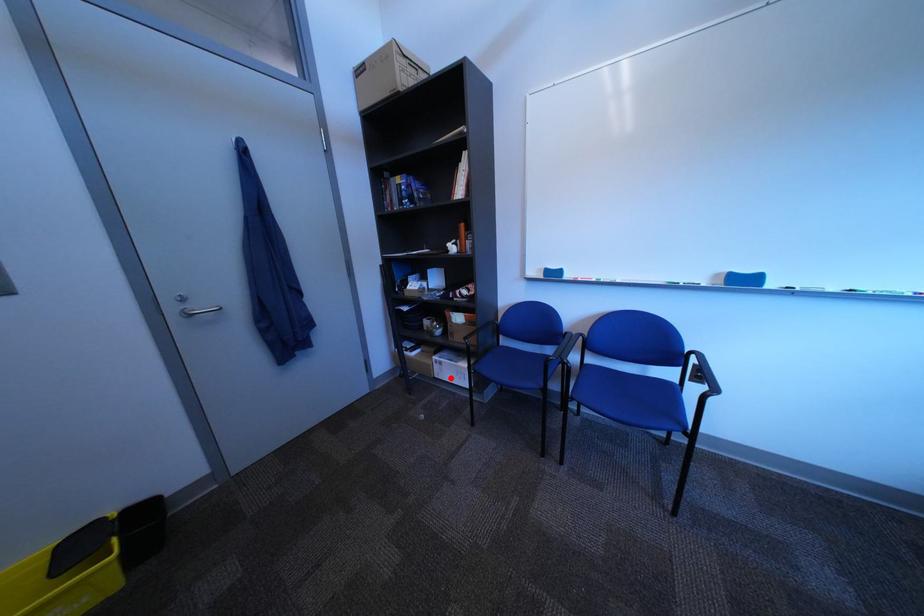
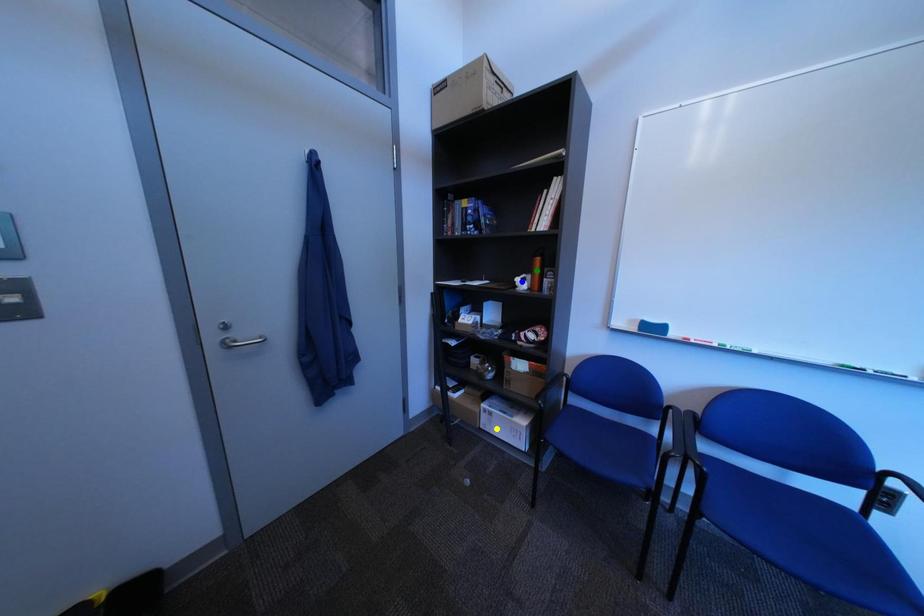
Question: I am providing you with two images of the same scene from different viewpoints. A red point is marked on the first image. You are given multiple points on the second image. Which point in image 2 is actually the same real-world point as the red point in image 1?

Choices:
 (A) blue point
 (B) yellow point
 (C) green point

Answer: (B)